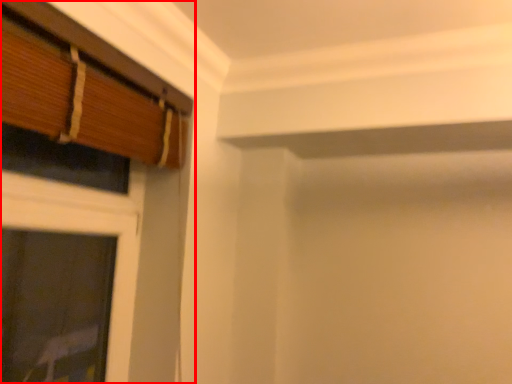
Question: Where is window (annotated by the red box) located in relation to window in the image?

Choices:
 (A) left
 (B) right

Answer: (A)